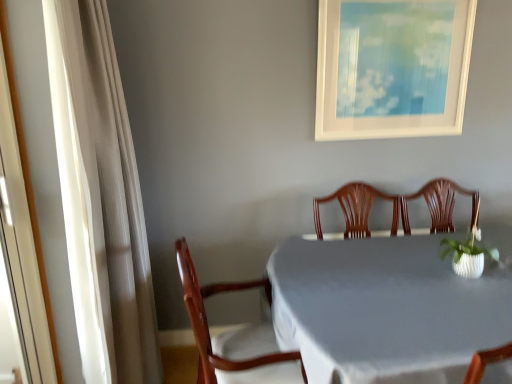
Question: Is white cloth-covered table at center spatially inside white textured vase at right, or outside of it?

Choices:
 (A) inside
 (B) outside

Answer: (B)

Question: Is point (403, 304) positioned closer to the camera than point (474, 248)?

Choices:
 (A) farther
 (B) closer

Answer: (B)

Question: Based on their relative distances, which object is farther from the white cloth-covered table at center?

Choices:
 (A) wooden chair at center
 (B) white glossy screen door at left
 (C) white matte picture frame at upper center
 (D) white sheer curtain at left
 (E) white textured vase at right

Answer: (B)

Question: Considering the real-world distances, which object is closest to the white textured vase at right?

Choices:
 (A) white glossy screen door at left
 (B) white sheer curtain at left
 (C) white matte picture frame at upper center
 (D) white cloth-covered table at center
 (E) wooden chair at center

Answer: (D)